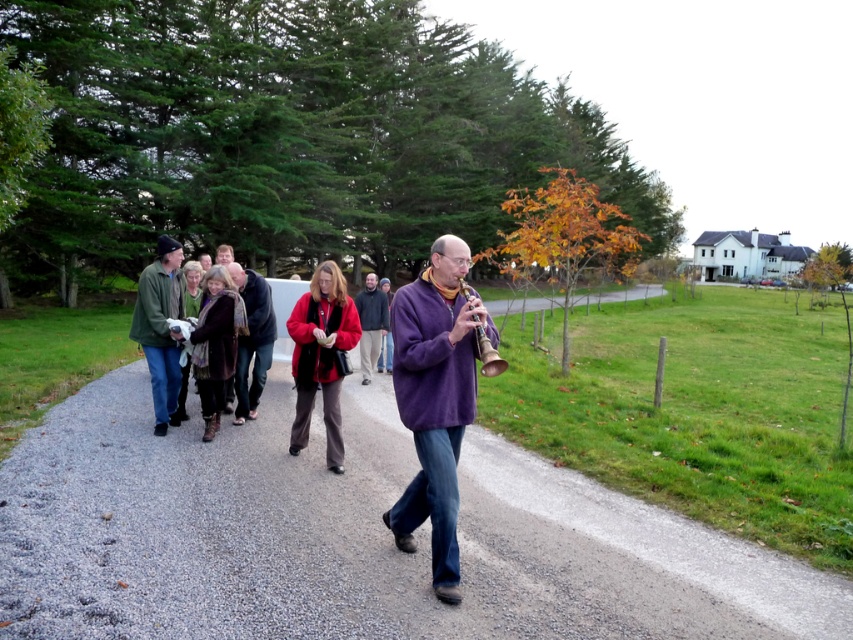
Can you confirm if brown woolen scarf at center is bigger than metallic gold flute at center?

Yes.

Which is in front, point (234, 312) or point (463, 285)?

Positioned in front is point (463, 285).

Describe the element at coordinates (216, 342) in the screenshot. This screenshot has width=853, height=640. I see `brown woolen scarf at center` at that location.

Where is `brown woolen scarf at center`? brown woolen scarf at center is located at coordinates (216, 342).

Can you confirm if red fleece jacket at center is bigger than red wool sweater at center?

Correct, red fleece jacket at center is larger in size than red wool sweater at center.

Measure the distance between red fleece jacket at center and camera.

6.13 meters

The width and height of the screenshot is (853, 640). What are the coordinates of `red fleece jacket at center` in the screenshot? It's located at (321, 356).

Is point (172, 339) closer to camera compared to point (485, 355)?

That is False.

Between green wool sweater at left and metallic gold flute at center, which one appears on the left side from the viewer's perspective?

green wool sweater at left is more to the left.

What are the coordinates of `green wool sweater at left` in the screenshot? It's located at (160, 328).

I want to click on green wool sweater at left, so click(160, 328).